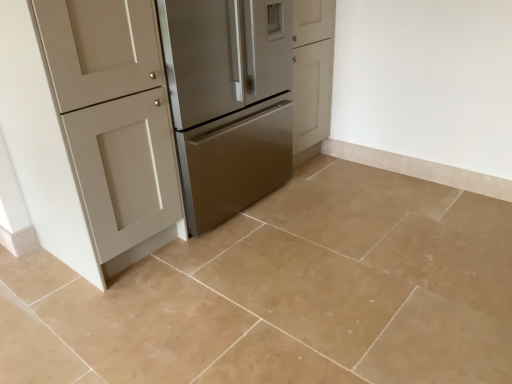
In the scene shown: In order to face stainless steel refrigerator at center, should I rotate leftwards or rightwards?

To face it directly, rotate left by 5.395 degrees.

What do you see at coordinates (228, 101) in the screenshot? This screenshot has width=512, height=384. I see `stainless steel refrigerator at center` at bounding box center [228, 101].

The height and width of the screenshot is (384, 512). In order to click on stainless steel refrigerator at center in this screenshot , I will do `click(228, 101)`.

Locate an element on the screen. This screenshot has height=384, width=512. stainless steel refrigerator at center is located at coordinates (228, 101).